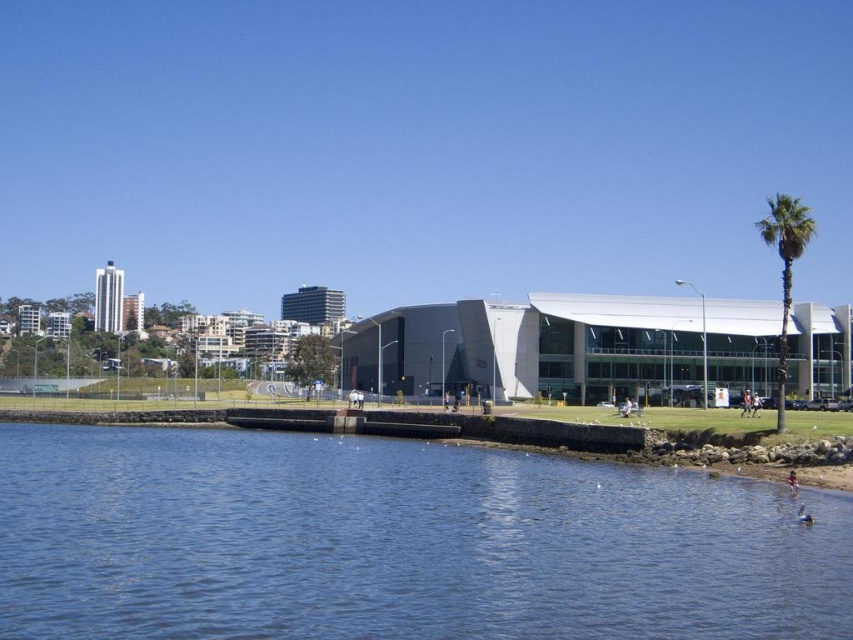
Can you confirm if blue water at lower left is positioned below green leafy palm tree at right?

Indeed, blue water at lower left is positioned under green leafy palm tree at right.

Can you confirm if blue water at lower left is bigger than green leafy palm tree at right?

Incorrect, blue water at lower left is not larger than green leafy palm tree at right.

What do you see at coordinates (397, 541) in the screenshot?
I see `blue water at lower left` at bounding box center [397, 541].

Identify the location of blue water at lower left. (397, 541).